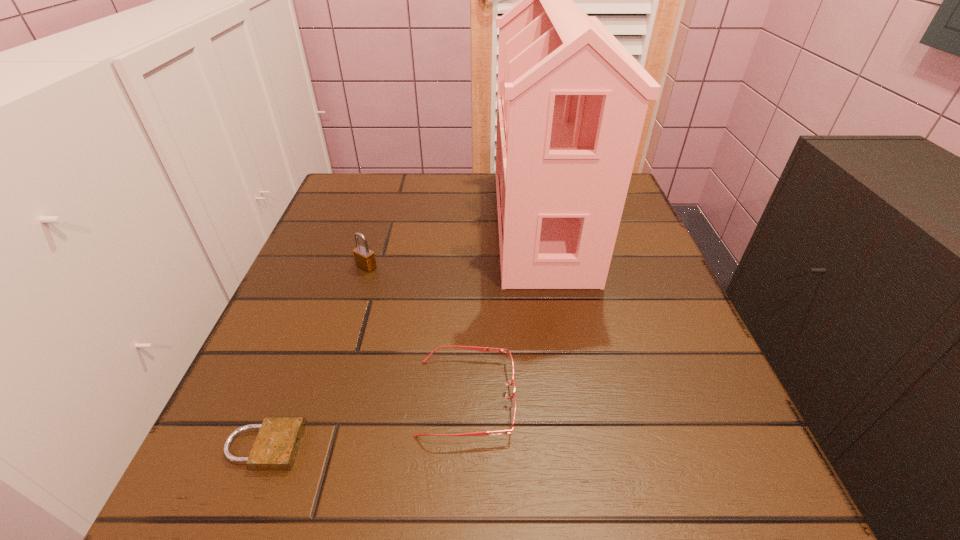
Locate an element on the screen. This screenshot has height=540, width=960. blank area at the right edge is located at coordinates (680, 414).

You are a GUI agent. You are given a task and a screenshot of the screen. Output one action in this format:
    pyautogui.click(x=<x>, y=<y>)
    Task: Click on the free space at the far left corner of the desktop
    The width and height of the screenshot is (960, 540).
    Given the screenshot: What is the action you would take?
    pyautogui.click(x=359, y=210)

This screenshot has height=540, width=960. Find the location of `free space between the dollhouse and the taller padlock`. free space between the dollhouse and the taller padlock is located at coordinates (454, 245).

At what (x,y) coordinates should I click in order to perform the action: click on unoccupied position between the shortest object and the second tallest object. Please return your answer as a coordinate pair (x, y). Looking at the image, I should click on (315, 356).

Find the location of a particular element. This screenshot has width=960, height=540. vacant area that lies between the tallest object and the second shortest object is located at coordinates (504, 310).

Find the location of a particular element. The image size is (960, 540). free area in between the spectacles and the dollhouse is located at coordinates (504, 310).

Locate an element on the screen. Image resolution: width=960 pixels, height=540 pixels. blank region between the nearer padlock and the third tallest object is located at coordinates (365, 422).

Where is `free space between the farther padlock and the spectacles`? This screenshot has width=960, height=540. free space between the farther padlock and the spectacles is located at coordinates (417, 332).

What are the coordinates of `empty space that is in between the taller padlock and the shorter padlock` in the screenshot? It's located at (315, 356).

Where is `vacant space that's between the nearer padlock and the tallest object`? This screenshot has width=960, height=540. vacant space that's between the nearer padlock and the tallest object is located at coordinates (402, 335).